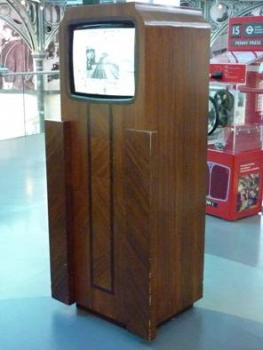
You are a GUI agent. You are given a task and a screenshot of the screen. Output one action in this format:
    pyautogui.click(x=<x>, y=<y>)
    Task: Click on the glass case
    This screenshot has width=263, height=350.
    Given the screenshot: What is the action you would take?
    pyautogui.click(x=239, y=137), pyautogui.click(x=228, y=142)